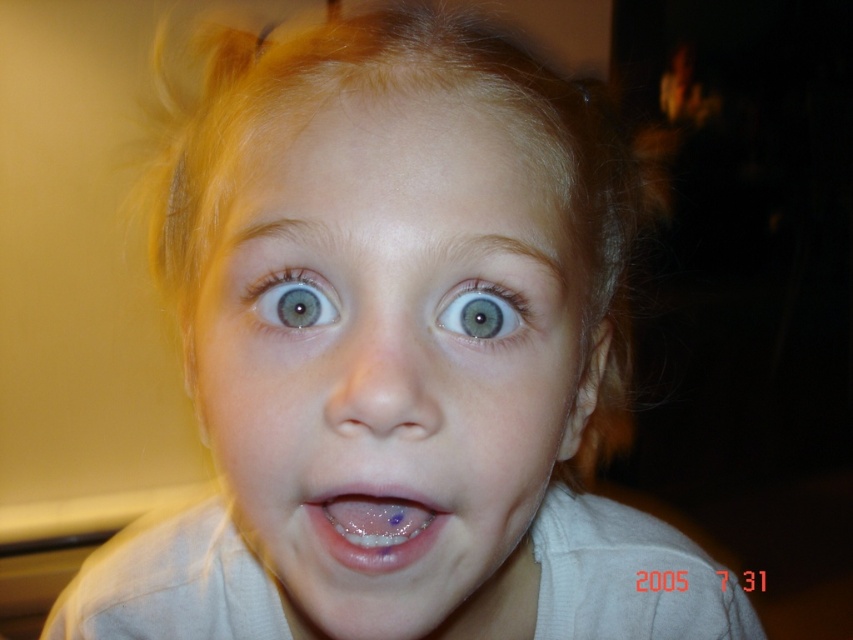
Question: Can you confirm if smooth skin face at center is bigger than shiny silver tongue at center?

Choices:
 (A) no
 (B) yes

Answer: (B)

Question: Which is farther from the smooth skin face at center?

Choices:
 (A) shiny silver tongue at center
 (B) blue glossy eye at center

Answer: (B)

Question: Which object is positioned closest to the blue matte eye at center?

Choices:
 (A) smooth skin face at center
 (B) shiny silver tongue at center
 (C) blue glossy eye at center

Answer: (C)

Question: Does smooth skin face at center appear under shiny silver tongue at center?

Choices:
 (A) no
 (B) yes

Answer: (A)

Question: Can you confirm if smooth skin face at center is wider than blue matte eye at center?

Choices:
 (A) yes
 (B) no

Answer: (A)

Question: Which object appears closest to the camera in this image?

Choices:
 (A) shiny silver tongue at center
 (B) blue matte eye at center

Answer: (A)